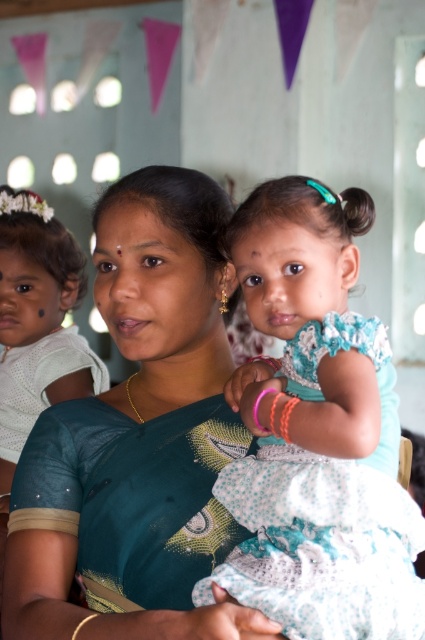
Is teal silk saree at center smaller than light blue fabric dress at center?

No.

Which is behind, point (144, 628) or point (266, 410)?

Point (266, 410)

Is point (203, 186) positioned behind point (227, 573)?

Yes, it is.

Where is `teal silk saree at center`? This screenshot has width=425, height=640. teal silk saree at center is located at coordinates (138, 435).

Is light blue fabric dress at center positioned behind white fabric at left?

No.

At what (x,y) coordinates should I click in order to perform the action: click on light blue fabric dress at center. Please return your answer as a coordinate pair (x, y). Image resolution: width=425 pixels, height=640 pixels. Looking at the image, I should click on (317, 433).

Is point (150, 460) positioned in front of point (65, 342)?

Yes, it is.

Measure the distance from teal silk saree at center to white fabric at left.

teal silk saree at center is 1.02 meters from white fabric at left.

Is point (146, 524) positioned behind point (34, 381)?

No, it is in front of (34, 381).

Locate an element on the screen. The width and height of the screenshot is (425, 640). teal silk saree at center is located at coordinates click(x=138, y=435).